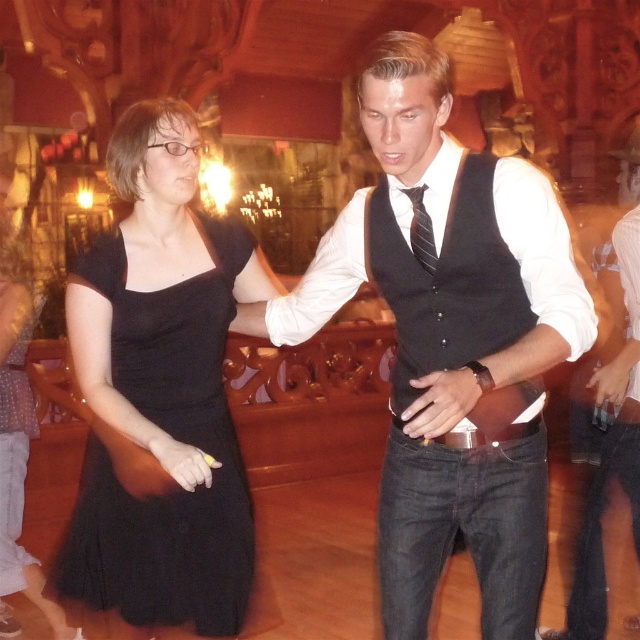
You are a guest at this event and want to compliment the host on their outfit. The host is wearing both the black wool vest at center and the striped fabric tie at center. Which item is positioned lower on their body?

The black wool vest at center is located below the striped fabric tie at center, so the vest is positioned lower on the host.

What is located at the coordinates point (449, 340) in the image?

The point (449, 340) marks the location of the black matte vest at center.

Looking at this image, you are a photographer at the event and want to capture both the black matte vest at center and the black tulle dress at center in a single photo. Since the camera can only focus on one subject at a time, which one should you focus on to ensure the other is still visible in the background?

You should focus on the black matte vest at center because it is in front of the black tulle dress at center, so the latter will naturally appear in the background of the photo.